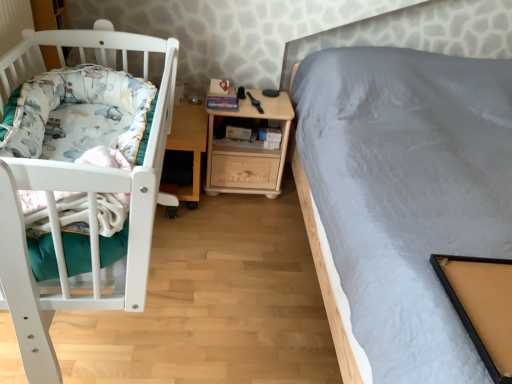
The height and width of the screenshot is (384, 512). I want to click on free space in front of wooden table at center, so click(x=199, y=230).